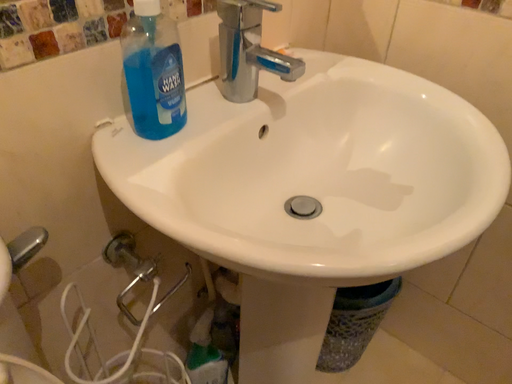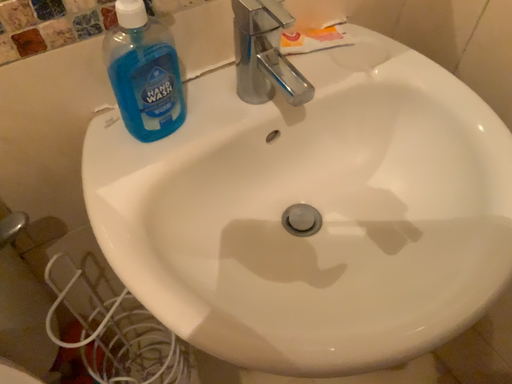
Question: How did the camera likely rotate when shooting the video?

Choices:
 (A) rotated downward
 (B) rotated upward

Answer: (A)